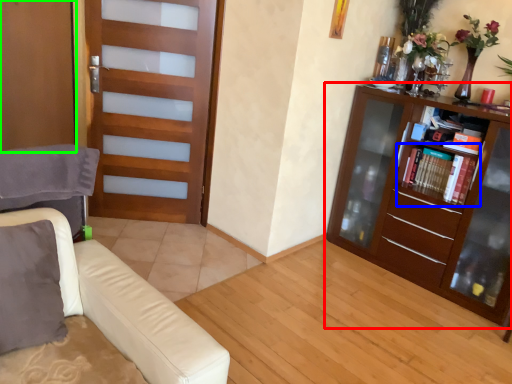
Question: Based on their relative distances, which object is nearer to bookcase (highlighted by a red box)? Choose from shelf (highlighted by a blue box) and screen door (highlighted by a green box).

Choices:
 (A) shelf
 (B) screen door

Answer: (A)